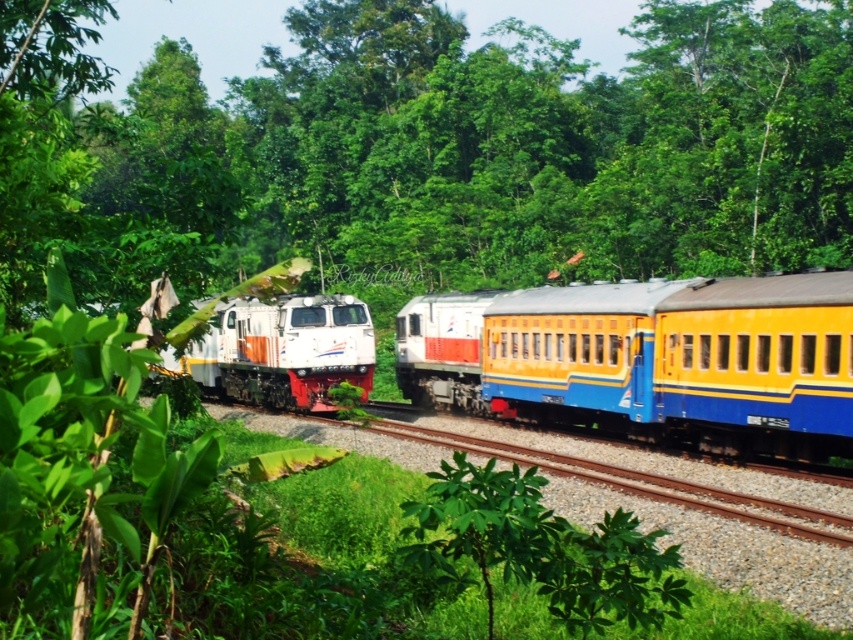
Question: Does yellow matte train car at center appear over white glossy locomotive at center?

Choices:
 (A) yes
 (B) no

Answer: (B)

Question: Which of these objects is positioned closest to the white glossy locomotive at center?

Choices:
 (A) yellow matte train car at center
 (B) green leafy tree at center

Answer: (A)

Question: Can you confirm if green leafy tree at center is bigger than white glossy locomotive at center?

Choices:
 (A) yes
 (B) no

Answer: (A)

Question: Does green leafy tree at center have a smaller size compared to yellow matte train car at center?

Choices:
 (A) yes
 (B) no

Answer: (B)

Question: Which object is closer to the camera taking this photo?

Choices:
 (A) yellow matte train car at center
 (B) green leafy tree at center

Answer: (B)

Question: Based on their relative distances, which object is nearer to the white glossy locomotive at center?

Choices:
 (A) yellow matte train car at center
 (B) green leafy tree at center

Answer: (A)